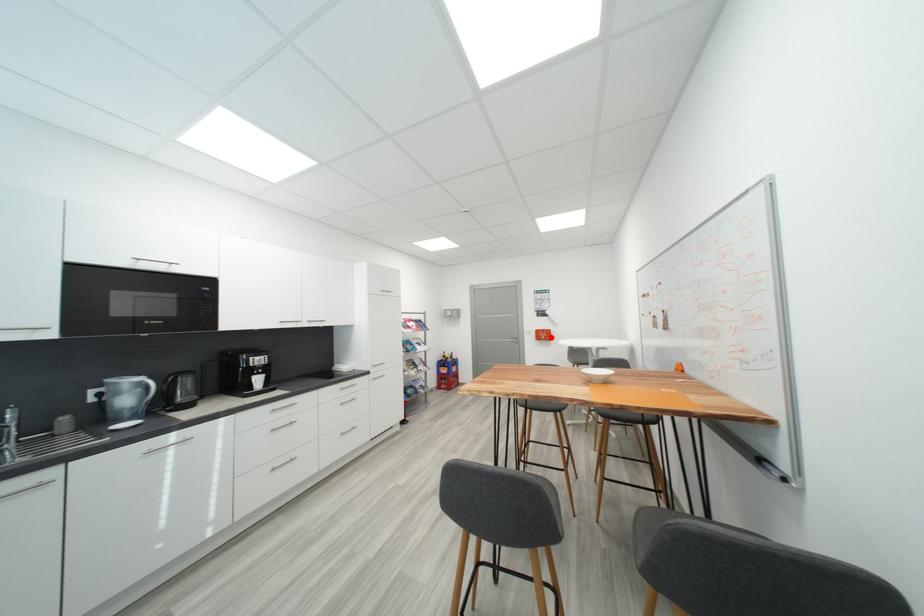
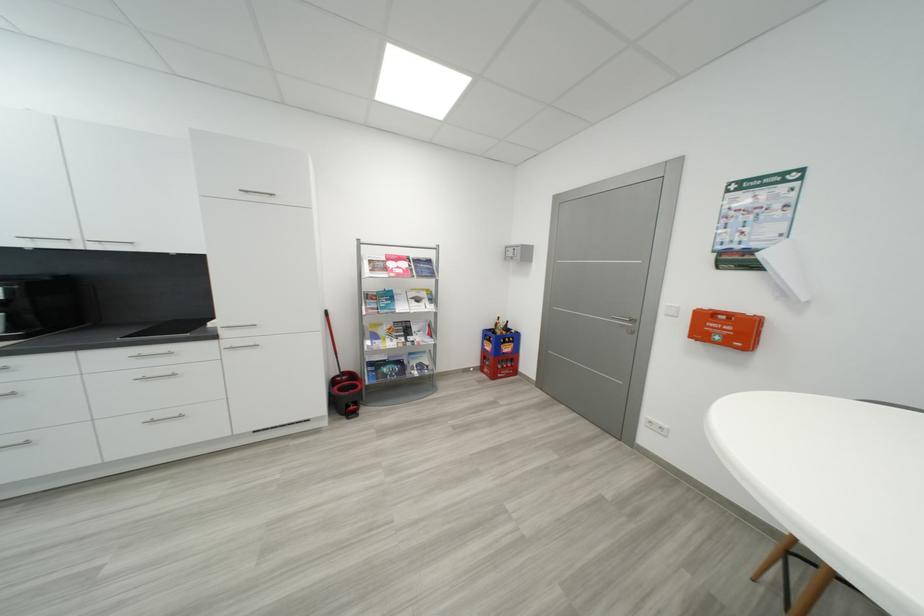
Locate, in the second image, the point that corresponds to the highlighted location in the first image.

(733, 333)